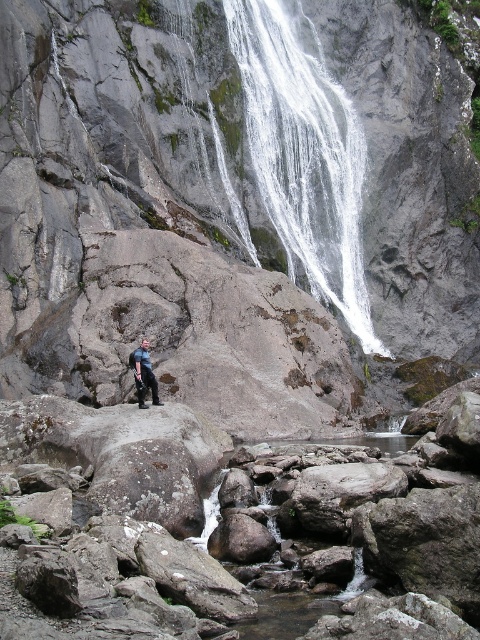
You are a hiker who wants to cross the river to reach the waterfall. You see the white frothy water at upper center and the blue denim jeans at center. Which one is higher up the cliff face?

The white frothy water at upper center is located above the blue denim jeans at center, so it is higher up the cliff face.